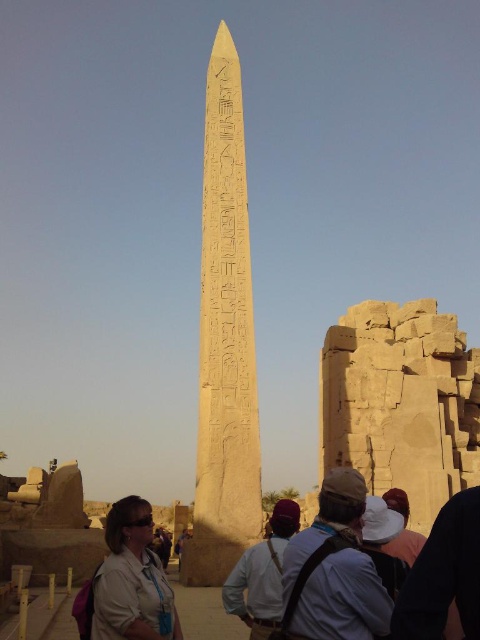
You are a photographer planning to capture the yellow sandstone obelisk at center and the white cotton hat at center in a single frame. Which object should you focus on first if you want to ensure both are in focus without changing the camera settings?

The yellow sandstone obelisk at center is wider than the white cotton hat at center, so focusing on the yellow sandstone obelisk at center first will help ensure both are in focus since it is larger and occupies more of the frame.

You are standing in front of the yellow sandstone obelisk at center and the white cotton hat at center. Which object is closer to you?

The yellow sandstone obelisk at center is closer to you than the white cotton hat at center because the obelisk is further to the viewer than the hat.

You are a photographer planning to take a photo of the ancient obelisk. You notice a tourist wearing a matte beige shirt at lower left and a tourist wearing a white cotton hat at center. Which tourist is closer to the camera based on their height in the photo?

The matte beige shirt at lower left is much taller than the white cotton hat at center in the photo, so the tourist wearing the matte beige shirt at lower left is closer to the camera.